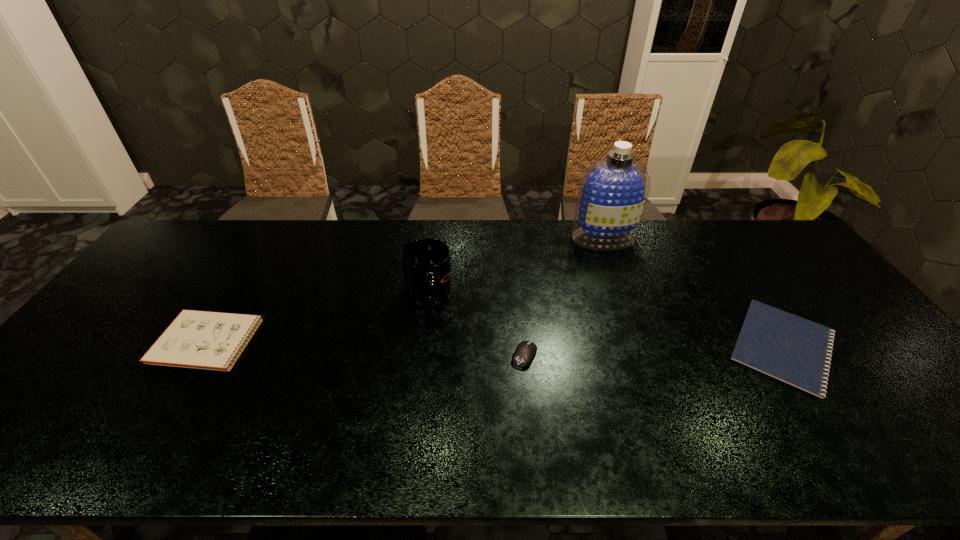
At what (x,y) coordinates should I click in order to perform the action: click on vacant space located with the handle on the side of the mug. Please return your answer as a coordinate pair (x, y). The height and width of the screenshot is (540, 960). Looking at the image, I should click on (423, 340).

You are a GUI agent. You are given a task and a screenshot of the screen. Output one action in this format:
    pyautogui.click(x=<x>, y=<y>)
    Task: Click on the vacant space situated 0.230m on the back of the leftmost object
    This screenshot has height=540, width=960.
    Given the screenshot: What is the action you would take?
    pyautogui.click(x=256, y=263)

Where is `vacant space situated on the back of the computer equipment`? This screenshot has height=540, width=960. vacant space situated on the back of the computer equipment is located at coordinates (515, 251).

At what (x,y) coordinates should I click in order to perform the action: click on vacant space located 0.130m on the front of the right notepad. Please return your answer as a coordinate pair (x, y). Looking at the image, I should click on (854, 453).

Find the location of `object that is positioned at the far edge`. object that is positioned at the far edge is located at coordinates (612, 193).

Locate an element on the screen. The image size is (960, 540). object at the right edge is located at coordinates (796, 351).

At what (x,y) coordinates should I click in order to perform the action: click on blank space at the far edge. Please return your answer as a coordinate pair (x, y). The image size is (960, 540). Looking at the image, I should click on (580, 257).

Find the location of a particular element. This screenshot has height=540, width=960. vacant space at the near edge of the desktop is located at coordinates (636, 437).

In the image, there is a desktop. At what (x,y) coordinates should I click in order to perform the action: click on free space at the right edge. Please return your answer as a coordinate pair (x, y). This screenshot has height=540, width=960. Looking at the image, I should click on (932, 412).

Where is `free area in between the third object from left to right and the mug`? free area in between the third object from left to right and the mug is located at coordinates (477, 326).